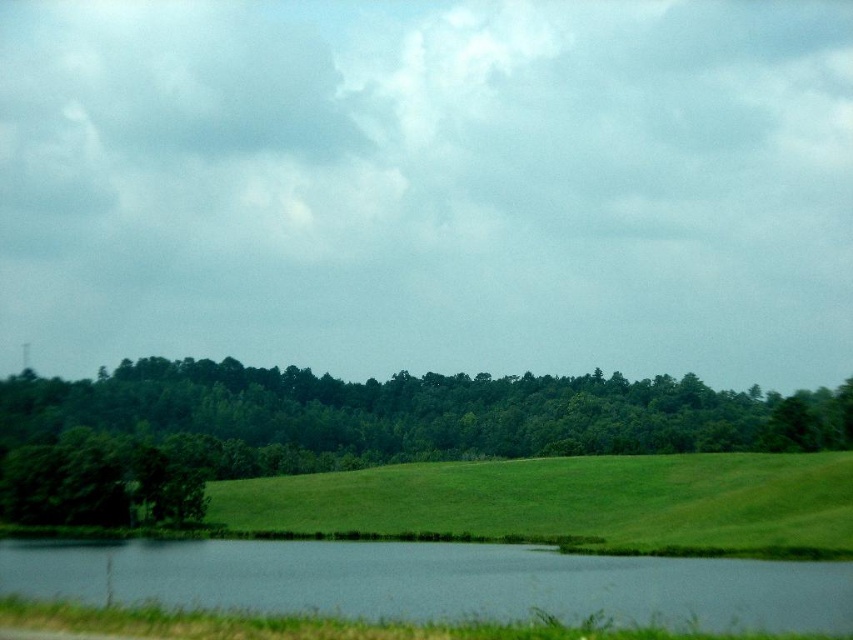
Can you confirm if green leafy trees at center is taller than green grassy lake at lower center?

Indeed, green leafy trees at center has a greater height compared to green grassy lake at lower center.

Is point (12, 403) behind point (376, 589)?

Yes, point (12, 403) is farther from viewer.

Identify the location of green leafy trees at center. (405, 417).